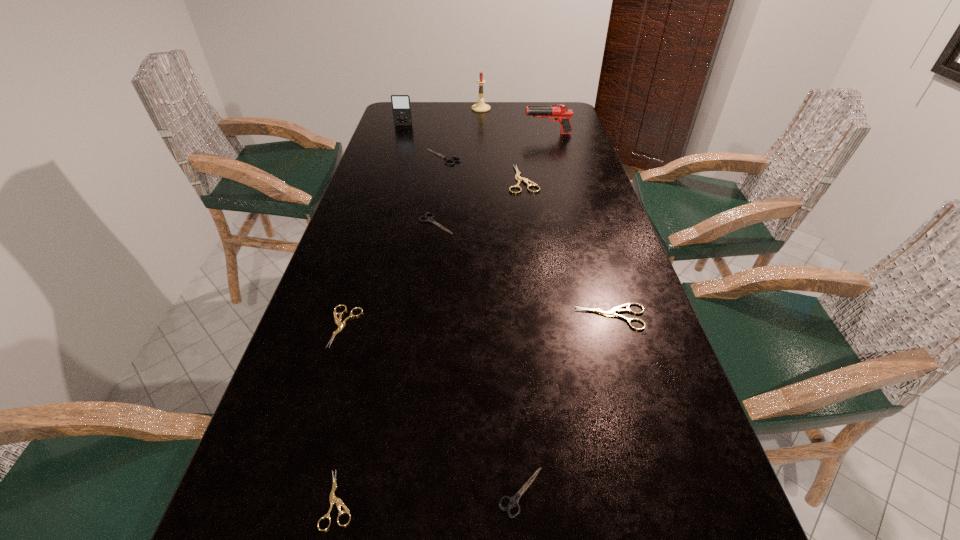
Find the location of `blank space located 0.220m at the aiming end of the gun`. blank space located 0.220m at the aiming end of the gun is located at coordinates (466, 134).

Find the location of a particular element. The height and width of the screenshot is (540, 960). free region located 0.310m at the aiming end of the gun is located at coordinates (442, 134).

Find the location of a particular element. The height and width of the screenshot is (540, 960). free spot located at the aiming end of the gun is located at coordinates (476, 134).

The image size is (960, 540). Find the location of `vacant area situated on the right of the farthest black shears`. vacant area situated on the right of the farthest black shears is located at coordinates (578, 157).

This screenshot has height=540, width=960. I want to click on vacant space located on the front of the biggest beige shears, so click(528, 215).

The height and width of the screenshot is (540, 960). In order to click on vacant region located on the right of the second smallest black shears in this screenshot , I will do `click(483, 224)`.

Locate an element on the screen. vacant space located 0.220m on the left of the rightmost shears is located at coordinates (474, 317).

The height and width of the screenshot is (540, 960). I want to click on vacant space situated on the front of the leftmost beige shears, so [320, 406].

The width and height of the screenshot is (960, 540). Find the location of `free location located 0.190m on the back of the smallest black shears`. free location located 0.190m on the back of the smallest black shears is located at coordinates (513, 370).

What are the coordinates of `free space located 0.120m on the right of the nearest beige shears` in the screenshot? It's located at (433, 499).